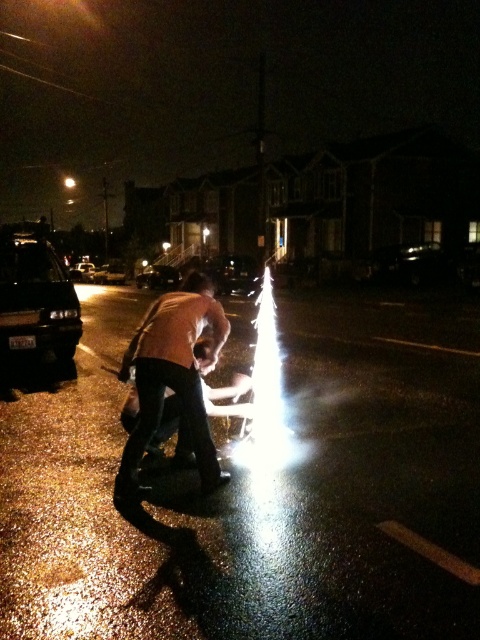
Question: Can you confirm if black glossy car at upper right is positioned to the left of shiny black sedan at center?

Choices:
 (A) no
 (B) yes

Answer: (A)

Question: Which is farther from the shiny silver sedan at left?

Choices:
 (A) shiny silver car at center
 (B) shiny black sedan at center
 (C) light brown leather jacket at center
 (D) black glossy car at left

Answer: (C)

Question: Based on their relative distances, which object is farther from the light brown leather jacket at center?

Choices:
 (A) black glossy car at upper right
 (B) metallic silver skateboard at center

Answer: (A)

Question: Does light brown leather jacket at center have a larger size compared to shiny black sedan at center?

Choices:
 (A) no
 (B) yes

Answer: (A)

Question: Which point is farther from the camera taking this photo?

Choices:
 (A) (153, 280)
 (B) (245, 284)
 (C) (115, 280)

Answer: (C)

Question: Can you confirm if metallic silver skateboard at center is positioned to the left of shiny black sedan at center?

Choices:
 (A) yes
 (B) no

Answer: (B)